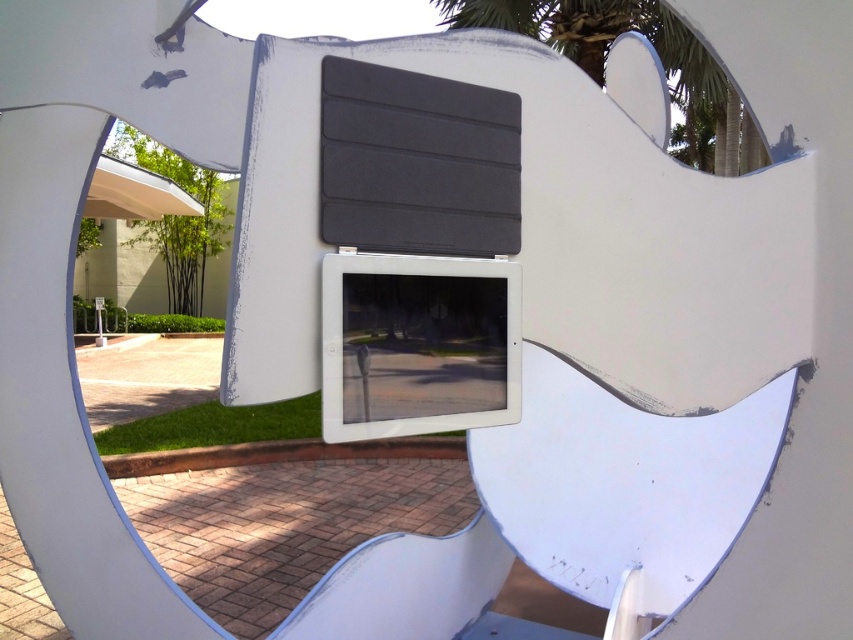
Question: Is green leafy palm tree at upper right closer to the viewer compared to green leafy palm tree at upper left?

Choices:
 (A) no
 (B) yes

Answer: (B)

Question: Among these objects, which one is farthest from the camera?

Choices:
 (A) green leafy palm tree at upper right
 (B) green leafy palm tree at upper left

Answer: (B)

Question: Which of the following is the closest to the observer?

Choices:
 (A) green leafy palm tree at upper right
 (B) green leafy palm tree at upper left

Answer: (A)

Question: Does green leafy palm tree at upper right appear on the right side of green leafy palm tree at upper left?

Choices:
 (A) no
 (B) yes

Answer: (B)

Question: Is green leafy palm tree at upper right wider than green leafy palm tree at upper left?

Choices:
 (A) no
 (B) yes

Answer: (A)